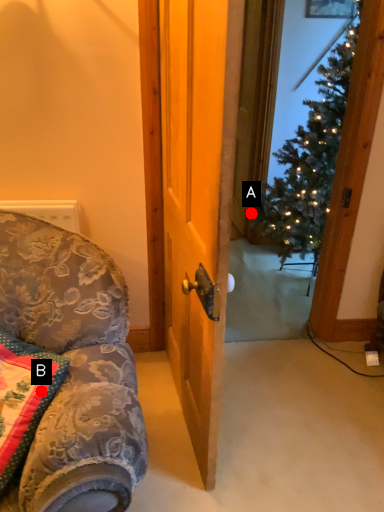
Question: Two points are circled on the image, labeled by A and B beside each circle. Which of the following is the farthest from the observer?

Choices:
 (A) A is further
 (B) B is further

Answer: (A)